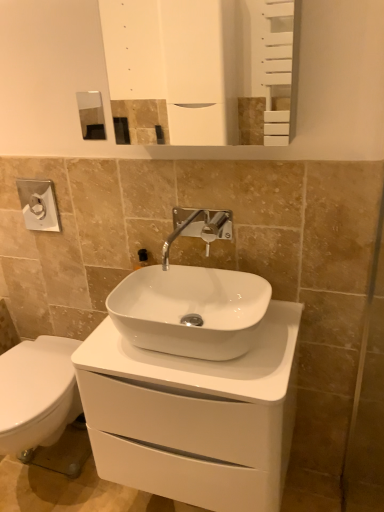
Question: Would you say white glossy mirror at upper center is to the left or to the right of white glossy cabinet at center in the picture?

Choices:
 (A) left
 (B) right

Answer: (B)

Question: Choose the correct answer: Is white glossy mirror at upper center inside white glossy cabinet at center or outside it?

Choices:
 (A) outside
 (B) inside

Answer: (A)

Question: Which object is the closest to the white glossy mirror at upper center?

Choices:
 (A) satin nickel faucet at center
 (B) white glossy sink at center
 (C) white glossy cabinet at center

Answer: (A)

Question: Which object is the farthest from the white glossy mirror at upper center?

Choices:
 (A) white glossy sink at center
 (B) satin nickel faucet at center
 (C) white glossy cabinet at center

Answer: (C)